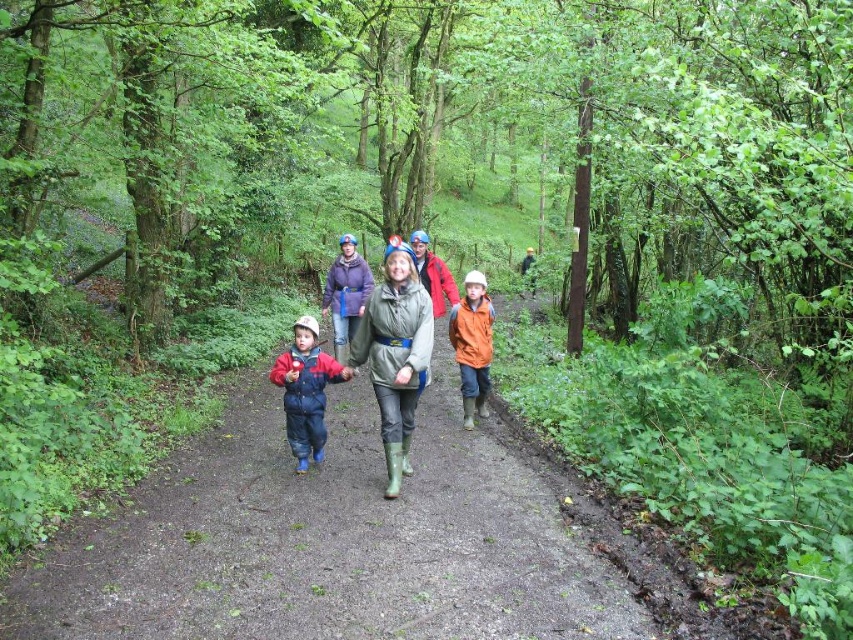
You are standing at the edge of the forest path and see the matte orange jacket at center. If you want to reach the jacket quickly, how many steps would you estimate you need to take? Assume each step covers about 3 feet.

The matte orange jacket at center is 22.22 feet away. Dividing the distance by your step length of 3 feet, you would need approximately 8 steps to reach it.

You are a photographer trying to capture a group photo of the matte blue jumpsuit at center and the orange matte jacket at center. Which person should you focus on first if you want to ensure the larger one is in focus?

The matte blue jumpsuit at center is bigger than the orange matte jacket at center, so you should focus on the matte blue jumpsuit at center first to ensure it is in focus.

You are a photographer trying to capture the group of people walking on the muddy path. You want to ensure both the green rubber boots at center and the orange matte jacket at center are visible in your shot. Based on their positions, which object should you focus on first to frame them properly?

The green rubber boots at center are to the left of the orange matte jacket at center. To frame them properly, focus on the green rubber boots at center first as it is positioned to the left, ensuring both are within the shot.